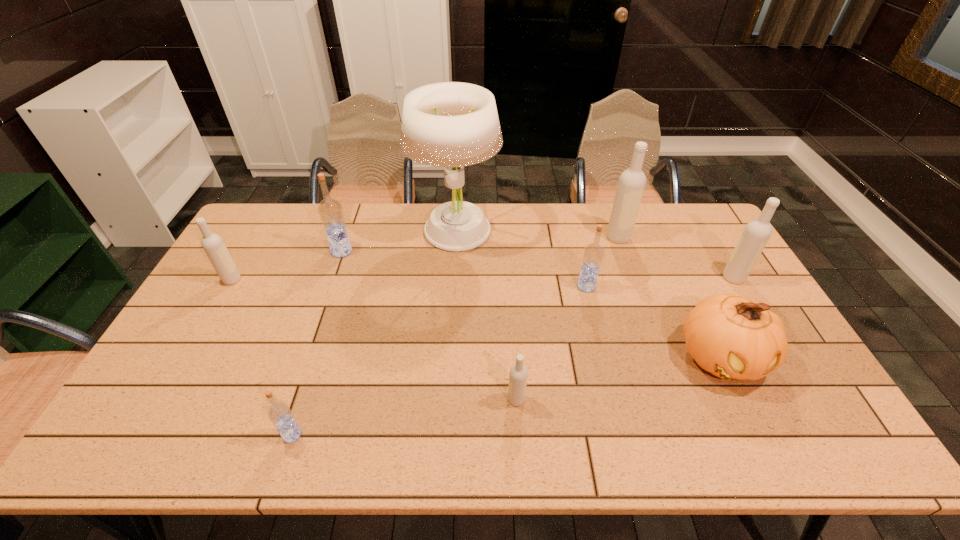
I want to click on vacant area at the far edge of the desktop, so click(595, 231).

You are a GUI agent. You are given a task and a screenshot of the screen. Output one action in this format:
    pyautogui.click(x=<x>, y=<y>)
    Task: Click on the free space at the near edge of the desktop
    
    Given the screenshot: What is the action you would take?
    pyautogui.click(x=761, y=448)

This screenshot has width=960, height=540. Find the location of `vacant space at the left edge of the desktop`. vacant space at the left edge of the desktop is located at coordinates (214, 362).

Locate an element on the screen. vacant area at the far left corner of the desktop is located at coordinates (267, 215).

The height and width of the screenshot is (540, 960). I want to click on vacant space at the near right corner, so click(823, 441).

The image size is (960, 540). What are the coordinates of `vacant area that lies between the biggest blue vodka and the rightmost vodka` in the screenshot? It's located at (538, 265).

Locate an element on the screen. empty space between the rightmost blue vodka and the pumpkin is located at coordinates (654, 322).

The width and height of the screenshot is (960, 540). What are the coordinates of `free space between the white lamp and the farthest blue vodka` in the screenshot? It's located at (398, 241).

You are a GUI agent. You are given a task and a screenshot of the screen. Output one action in this format:
    pyautogui.click(x=<x>, y=<y>)
    Task: Click on the empty location between the second object from right to left and the smallest white vodka
    The width and height of the screenshot is (960, 540).
    Given the screenshot: What is the action you would take?
    pyautogui.click(x=618, y=378)

At what (x,y) coordinates should I click in order to perform the action: click on unoccupied position between the farthest white vodka and the sixth object from left to right. Please return your answer as a coordinate pair (x, y). This screenshot has height=540, width=960. Looking at the image, I should click on (602, 262).